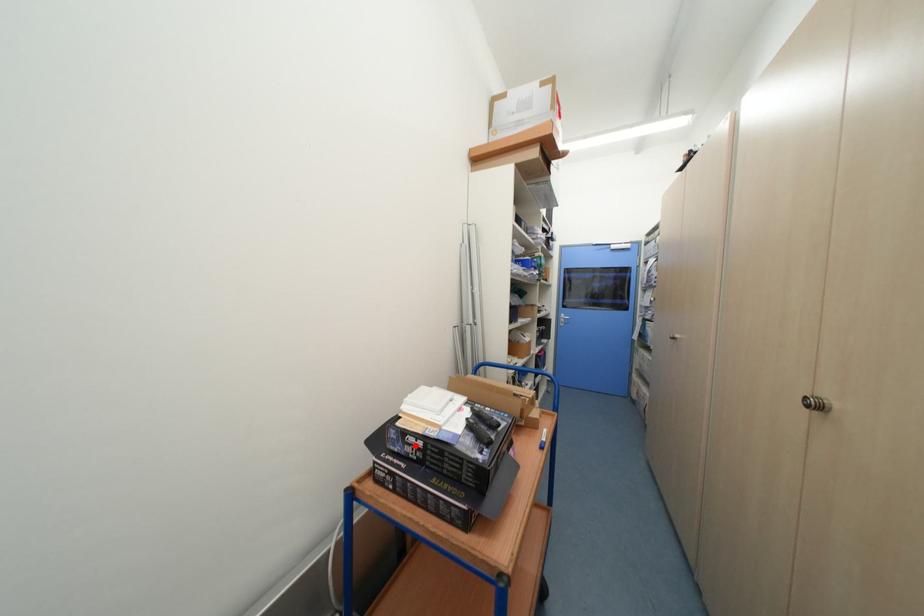
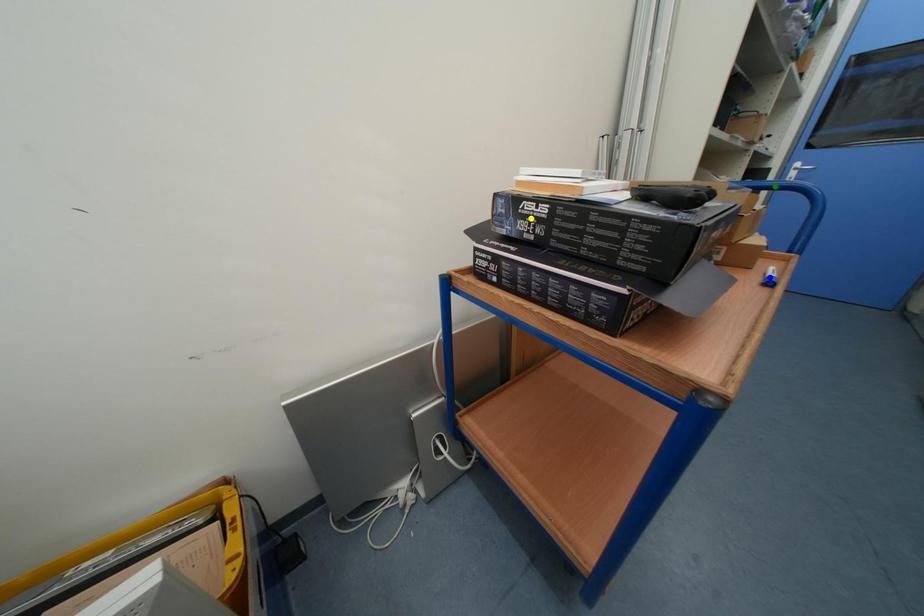
Question: I am providing you with two images of the same scene from different viewpoints. A red point is marked on the first image. You are given multiple points on the second image. Which mark in image 2 goes with the point in image 1?

Choices:
 (A) green point
 (B) yellow point
 (C) blue point

Answer: (B)